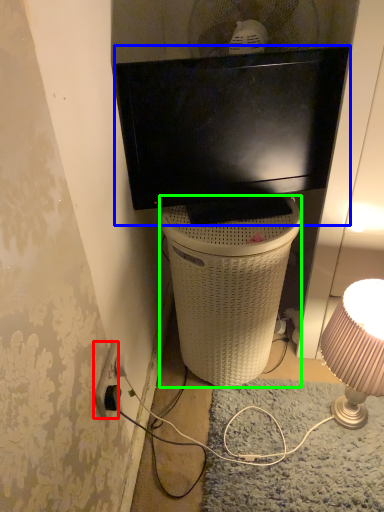
Question: Estimate the real-world distances between objects in this image. Which object is farther from power outlet (highlighted by a red box), television (highlighted by a blue box) or trash bin/can (highlighted by a green box)?

Choices:
 (A) television
 (B) trash bin/can

Answer: (A)